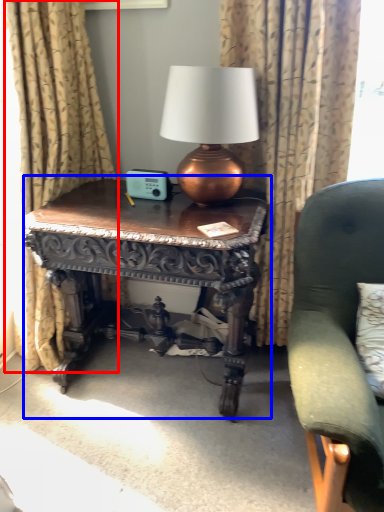
Question: Which of the following is the farthest to the observer, curtain (highlighted by a red box) or table (highlighted by a blue box)?

Choices:
 (A) curtain
 (B) table

Answer: (B)